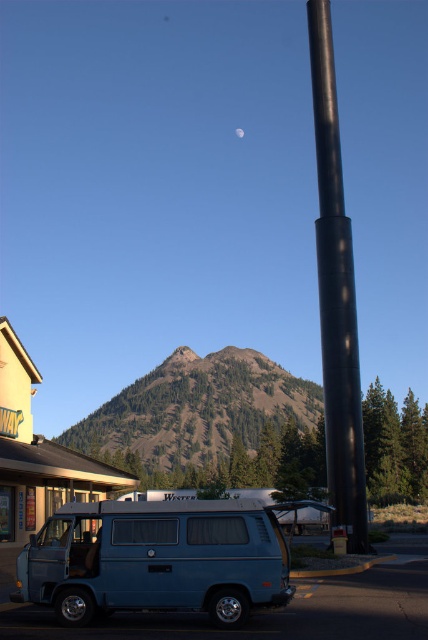
You are standing at the point marked as point (211, 422). What do you see directly in front of you?

At point (211, 422), you see the green textured mountain at center directly in front of you.

You are a photographer setting up a tripod to capture the mountain in the background. You have two objects in the frame, the blue matte van at lower left and the black matte pole at center. Which object will require you to adjust your camera angle more to avoid blocking the mountain?

The black matte pole at center will require adjusting the camera angle more because it is wider than the blue matte van at lower left, making it more likely to block the mountain view.